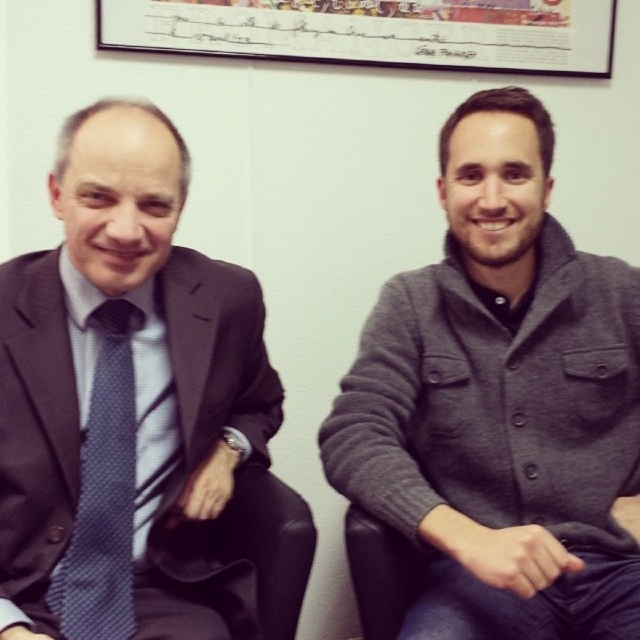
Based on the scene description, where is the gray woolen sweater at right located in the image?

The gray woolen sweater at right is located at the 2D coordinates point (500, 401) in the image.

You are a fashion stylist trying to match outfits for a photoshoot. You have two items to place in the scene shown. The gray woolen sweater at right and the matte blue tie at left. Which item is positioned to the right of the other?

The gray woolen sweater at right is positioned to the right of the matte blue tie at left.